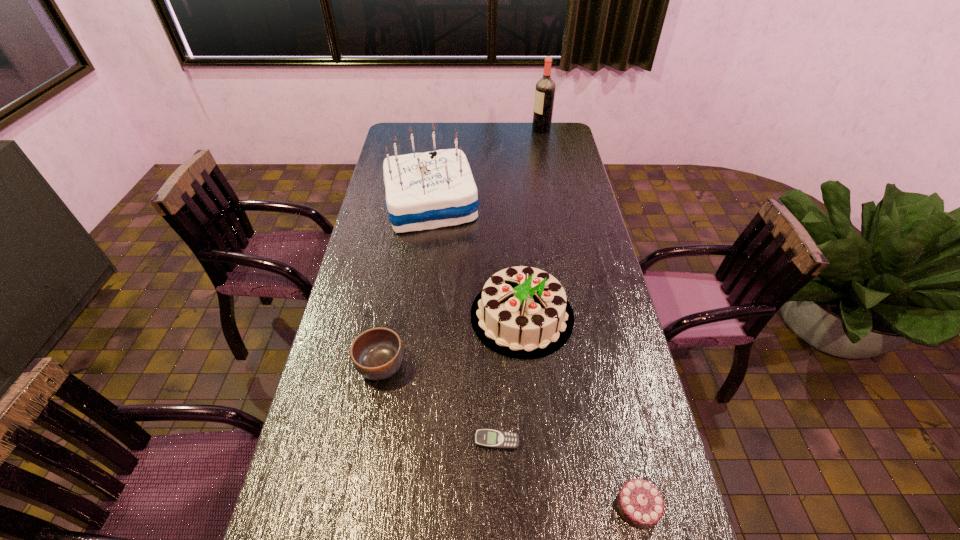
Where is `liquor`? liquor is located at coordinates (545, 88).

In order to click on the farthest object in this screenshot , I will do `click(545, 88)`.

Identify the location of the farther birthday cake. The image size is (960, 540). (429, 190).

The width and height of the screenshot is (960, 540). I want to click on the second farthest object, so click(429, 190).

You are a GUI agent. You are given a task and a screenshot of the screen. Output one action in this format:
    pyautogui.click(x=<x>, y=<y>)
    Task: Click on the shorter birthday cake
    Image resolution: width=960 pixels, height=540 pixels.
    Given the screenshot: What is the action you would take?
    pyautogui.click(x=522, y=312)

You are a GUI agent. You are given a task and a screenshot of the screen. Output one action in this format:
    pyautogui.click(x=<x>, y=<y>)
    Task: Click on the nearer birthday cake
    The image size is (960, 540).
    Given the screenshot: What is the action you would take?
    pyautogui.click(x=522, y=312)

The width and height of the screenshot is (960, 540). Find the location of `bowl`. bowl is located at coordinates (377, 354).

Where is `the fifth tallest object`? the fifth tallest object is located at coordinates (639, 502).

Find the location of a particular element. chocolate cake is located at coordinates (639, 502).

Find the location of a particular element. Image resolution: width=960 pixels, height=540 pixels. the shortest object is located at coordinates (486, 438).